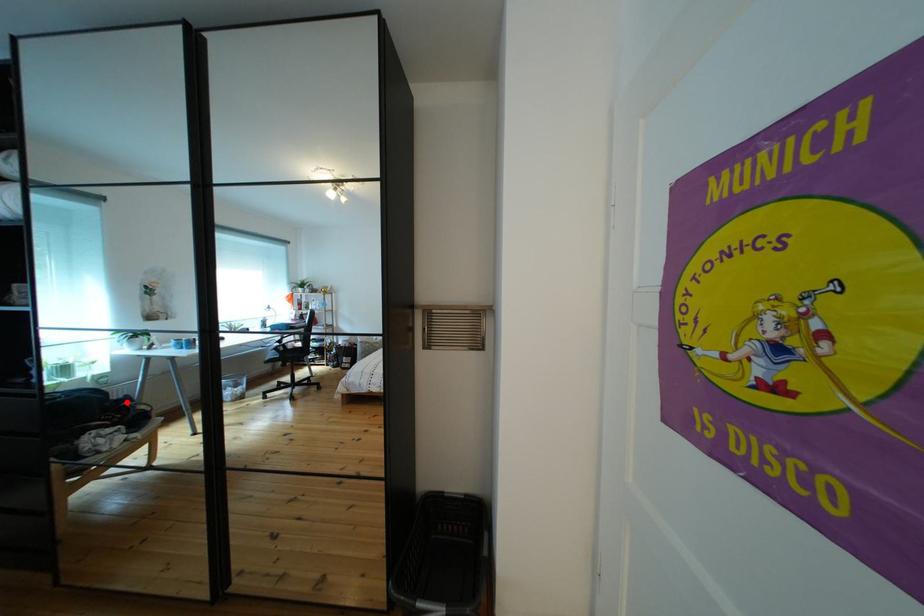
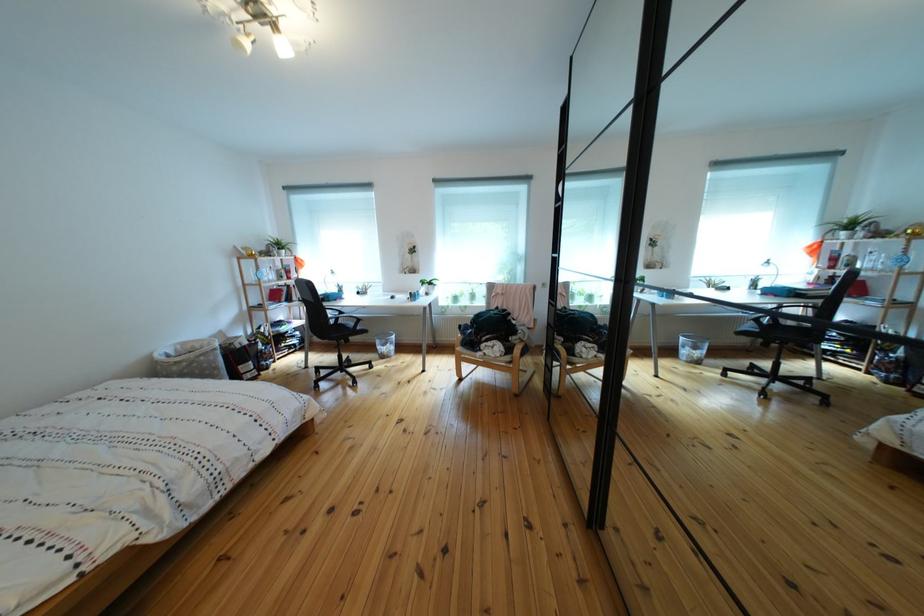
Question: A red point is marked in image1. In image2, is the corresponding 3D point closer to the camera or farther? Reply with the corresponding letter.

Choices:
 (A) The corresponding 3D point is closer.
 (B) The corresponding 3D point is farther.

Answer: (B)